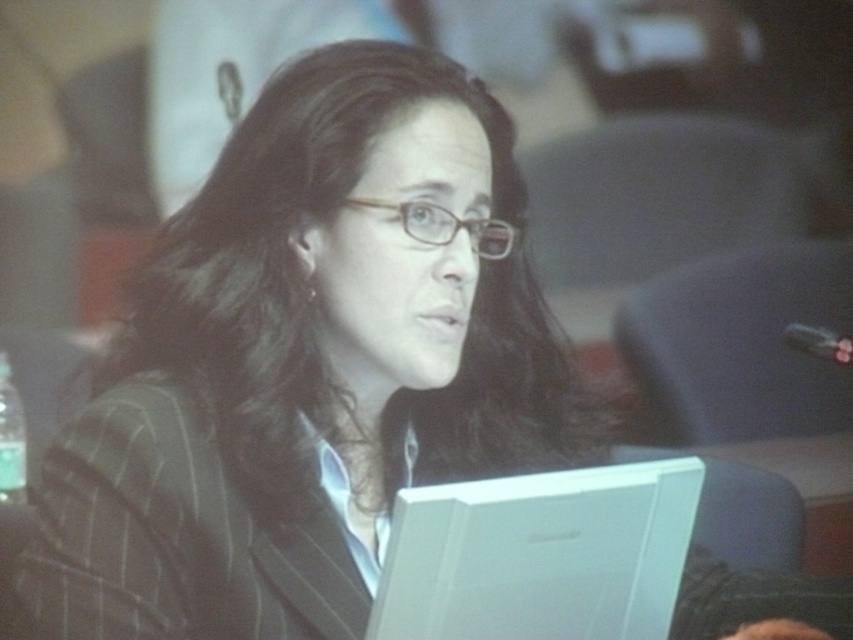
You are standing in the room and want to reach the point marked as point (512, 168). If your maximum reach without moving is 1 meter, can you touch it?

The distance between you and point (512, 168) is 1.12 meters, which is beyond your 1 meter reach. Therefore, you cannot touch it without moving closer.

You are a photographer who needs to capture a clear shot of the white plastic laptop at lower center without the dark brown silky hair at center blocking it. How can you adjust your position to achieve this?

The dark brown silky hair at center is taller than the white plastic laptop at lower center. To avoid the hair blocking the laptop, you should position yourself lower or angle your camera downward so that the hair is below the camera lens, allowing a clear view of the laptop.

You are taking a photo of the scene and want to ensure both point [136,420] and point [643,621] are in focus. Given that your camera can only focus on objects at the same distance from the camera, which point should you focus on to maximize the chance of both being in focus?

You should focus on point [643,621] because it is farther from the camera than point [136,420]. By focusing on the farther point, the near point will also be within the depth of field, maximizing the chance of both being in focus.